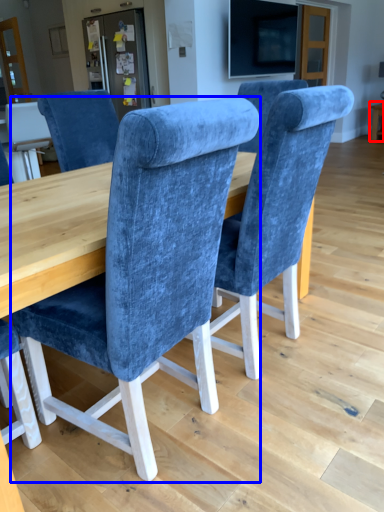
Question: Which point is further to the camera, table (highlighted by a red box) or chair (highlighted by a blue box)?

Choices:
 (A) table
 (B) chair

Answer: (A)